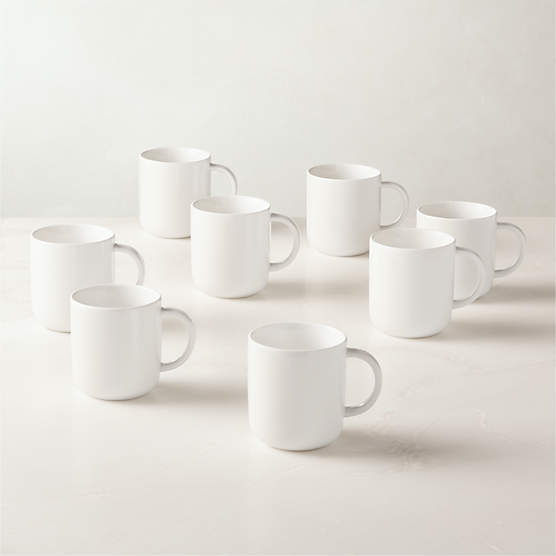
At what (x,y) coordinates should I click in order to perform the action: click on white teacups. Please return your answer as a coordinate pair (x, y). Looking at the image, I should click on (123, 358), (64, 281), (234, 253), (180, 192), (339, 197), (401, 278), (479, 236), (284, 409).